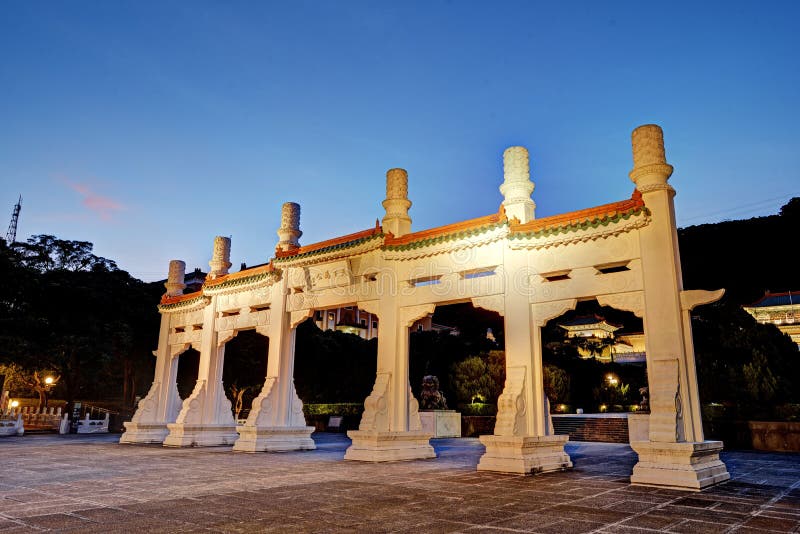
Find the location of a particular element. The width and height of the screenshot is (800, 534). decorative arch detail is located at coordinates (174, 344), (197, 340), (226, 333), (268, 326), (294, 314), (374, 307), (414, 314), (486, 308), (546, 309), (632, 300).